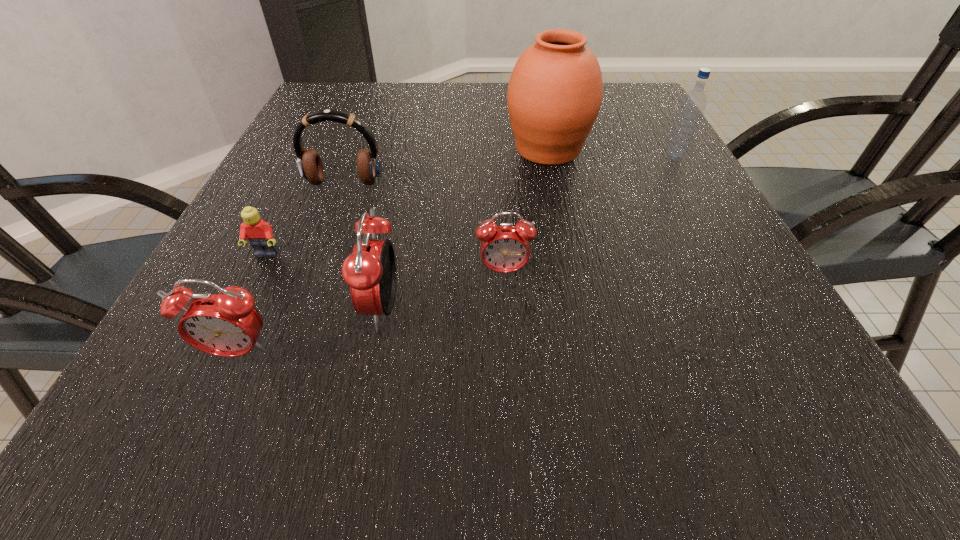
Where is `the leftmost alarm clock`? The width and height of the screenshot is (960, 540). the leftmost alarm clock is located at coordinates (226, 324).

Find the location of a particular element. the fourth object from right to left is located at coordinates (370, 271).

Where is `the rightmost alarm clock`? The height and width of the screenshot is (540, 960). the rightmost alarm clock is located at coordinates (505, 248).

Locate an element on the screen. The height and width of the screenshot is (540, 960). the second shortest object is located at coordinates (505, 248).

Image resolution: width=960 pixels, height=540 pixels. I want to click on the third farthest object, so pos(309,164).

At what (x,y) coordinates should I click in order to perform the action: click on urn. Please return your answer as a coordinate pair (x, y). Looking at the image, I should click on (554, 96).

Where is `water bottle`? The image size is (960, 540). water bottle is located at coordinates (690, 112).

Identify the location of Lego. The width and height of the screenshot is (960, 540). (259, 233).

Find the location of a particular element. the shortest object is located at coordinates (259, 233).

You are a GUI agent. You are given a task and a screenshot of the screen. Output one action in this format:
    pyautogui.click(x=<x>, y=<y>)
    Task: Click on the blank space located on the face of the second alarm clock from right to left
    Image resolution: width=960 pixels, height=540 pixels.
    Given the screenshot: What is the action you would take?
    pyautogui.click(x=230, y=309)